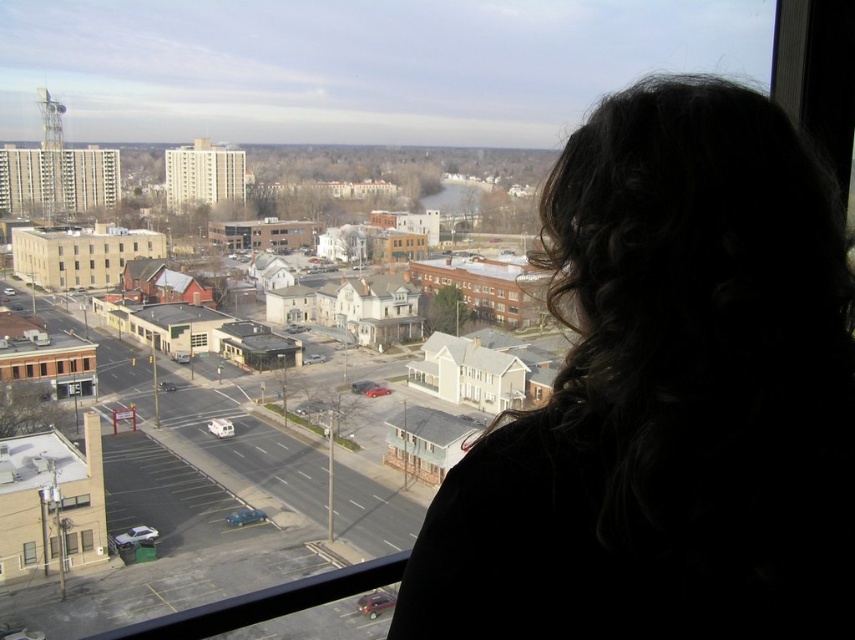
Question: Is dark curly hair at upper right above transparent glass window at lower left?

Choices:
 (A) yes
 (B) no

Answer: (A)

Question: Does dark curly hair at upper right have a lesser width compared to transparent glass window at lower left?

Choices:
 (A) no
 (B) yes

Answer: (A)

Question: Which object appears closest to the camera in this image?

Choices:
 (A) dark curly hair at upper right
 (B) transparent glass window at lower left

Answer: (A)

Question: Does dark curly hair at upper right have a larger size compared to transparent glass window at lower left?

Choices:
 (A) yes
 (B) no

Answer: (A)